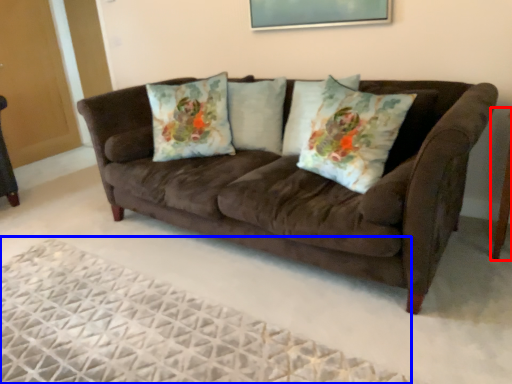
Question: Which point is further to the camera, side table (highlighted by a red box) or plain (highlighted by a blue box)?

Choices:
 (A) side table
 (B) plain

Answer: (A)